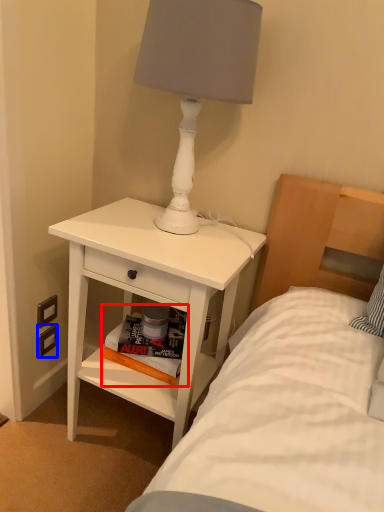
Question: Which of the following is the farthest to the observer, magazine (highlighted by a red box) or electric outlet (highlighted by a blue box)?

Choices:
 (A) magazine
 (B) electric outlet

Answer: (B)